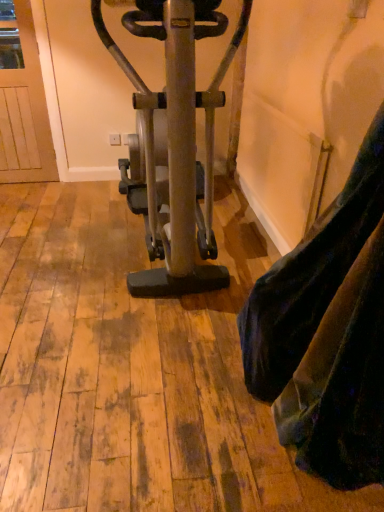
Question: Is velvet-like fabric at lower right at the right side of metallic gold stationary bicycle at center?

Choices:
 (A) no
 (B) yes

Answer: (B)

Question: From a real-world perspective, is velvet-like fabric at lower right over metallic gold stationary bicycle at center?

Choices:
 (A) no
 (B) yes

Answer: (A)

Question: Does velvet-like fabric at lower right contain metallic gold stationary bicycle at center?

Choices:
 (A) no
 (B) yes

Answer: (A)

Question: Does velvet-like fabric at lower right come behind metallic gold stationary bicycle at center?

Choices:
 (A) no
 (B) yes

Answer: (A)

Question: Are velvet-like fabric at lower right and metallic gold stationary bicycle at center far apart?

Choices:
 (A) no
 (B) yes

Answer: (A)

Question: Is velvet-like fabric at lower right completely or partially outside of metallic gold stationary bicycle at center?

Choices:
 (A) no
 (B) yes

Answer: (B)

Question: Is metallic gold stationary bicycle at center to the left of velvet-like fabric at lower right from the viewer's perspective?

Choices:
 (A) yes
 (B) no

Answer: (A)

Question: Could you tell me if metallic gold stationary bicycle at center is facing velvet-like fabric at lower right?

Choices:
 (A) yes
 (B) no

Answer: (B)

Question: Can you confirm if metallic gold stationary bicycle at center is bigger than velvet-like fabric at lower right?

Choices:
 (A) yes
 (B) no

Answer: (A)

Question: Considering the relative positions of metallic gold stationary bicycle at center and velvet-like fabric at lower right in the image provided, is metallic gold stationary bicycle at center to the right of velvet-like fabric at lower right from the viewer's perspective?

Choices:
 (A) no
 (B) yes

Answer: (A)

Question: From a real-world perspective, is metallic gold stationary bicycle at center physically below velvet-like fabric at lower right?

Choices:
 (A) yes
 (B) no

Answer: (B)

Question: Does metallic gold stationary bicycle at center come behind velvet-like fabric at lower right?

Choices:
 (A) no
 (B) yes

Answer: (B)

Question: From a real-world perspective, relative to velvet-like fabric at lower right, is metallic gold stationary bicycle at center vertically above or below?

Choices:
 (A) above
 (B) below

Answer: (A)